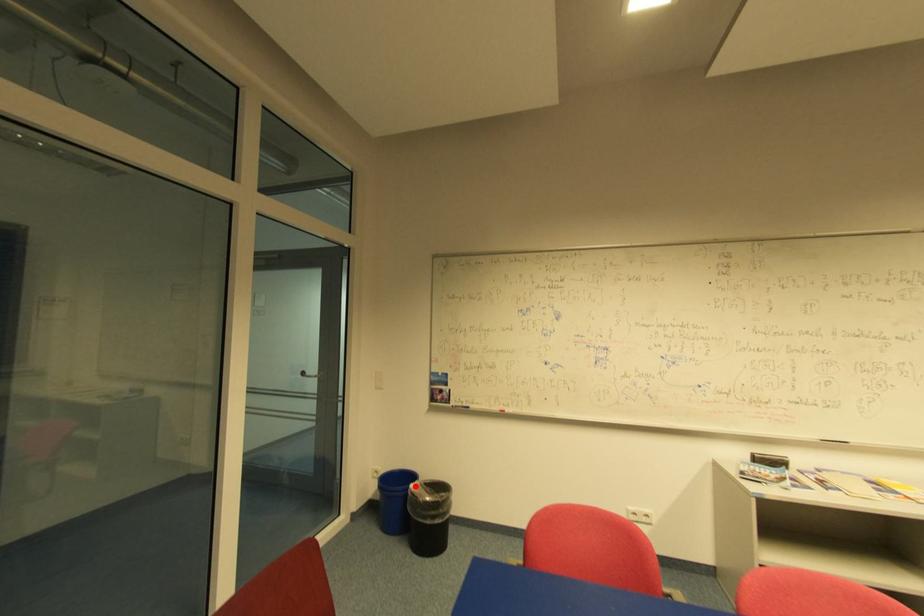
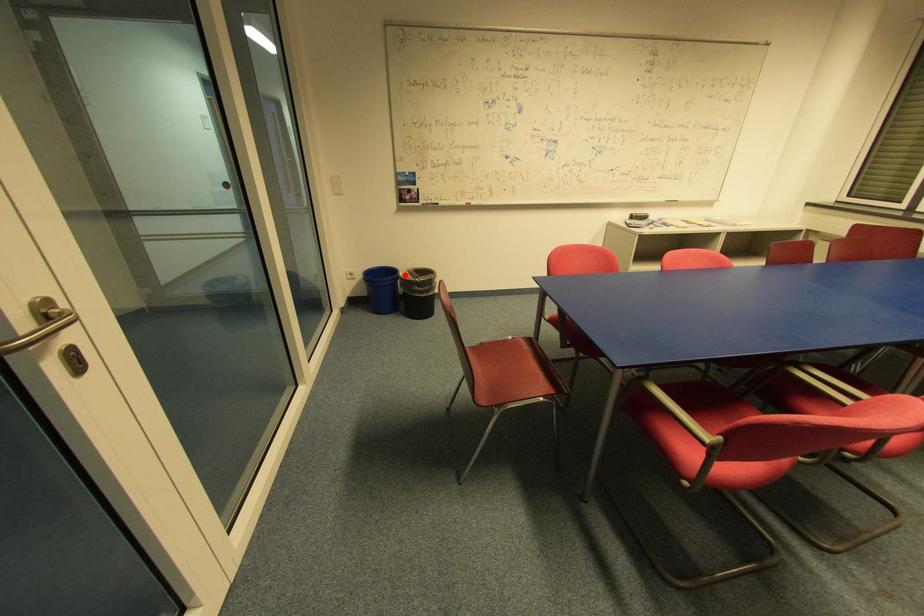
I am providing you with two images of the same scene from different viewpoints. A red point is marked on the first image and another point is marked on the second image. Is the marked point in image1 the same physical position as the marked point in image2?

Yes